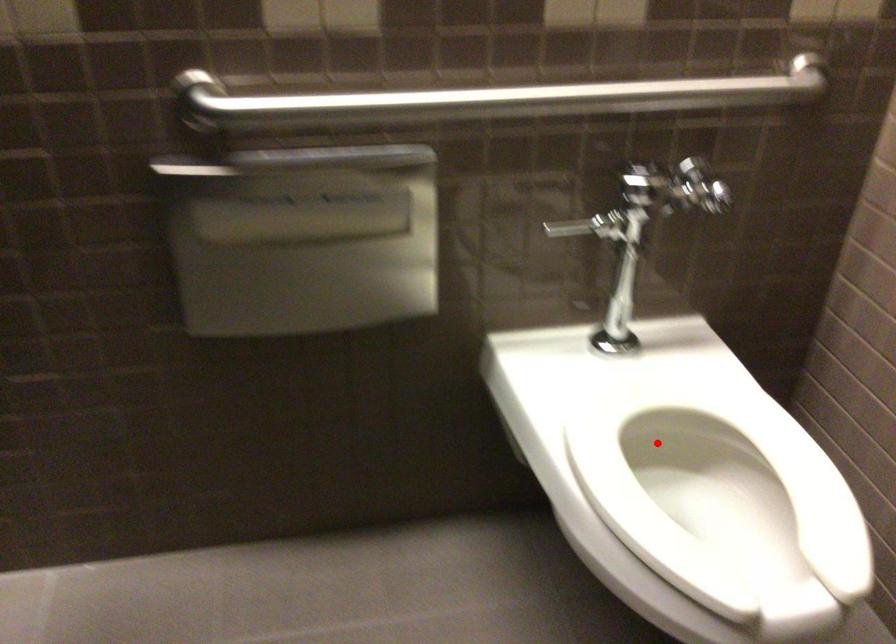
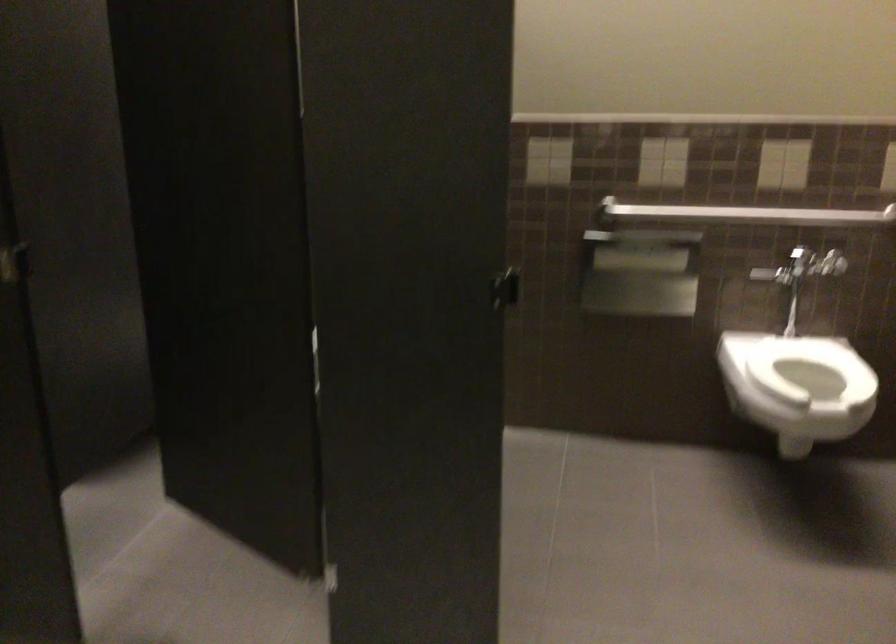
Locate, in the second image, the point that corresponds to the highlighted location in the first image.

(810, 368)